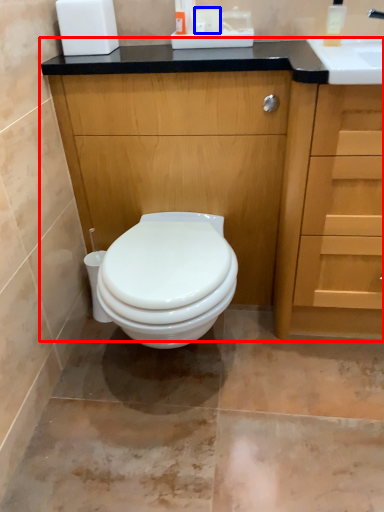
Question: Among these objects, which one is farthest to the camera, bathroom cabinet (highlighted by a red box) or toilet paper (highlighted by a blue box)?

Choices:
 (A) bathroom cabinet
 (B) toilet paper

Answer: (B)